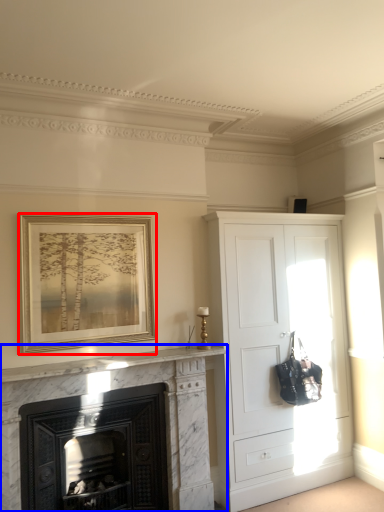
Question: Among these objects, which one is farthest to the camera, picture frame (highlighted by a red box) or fireplace (highlighted by a blue box)?

Choices:
 (A) picture frame
 (B) fireplace

Answer: (A)